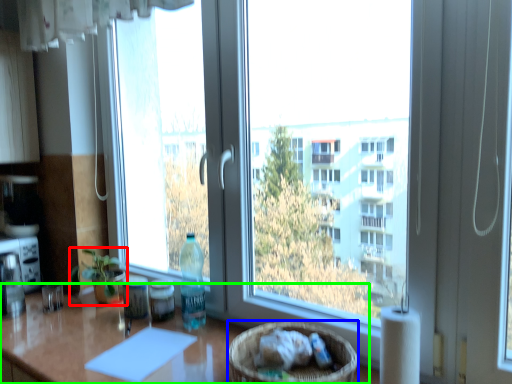
Question: Considering the real-world distances, which object is closest to houseplant (highlighted by a red box)? basket (highlighted by a blue box) or table (highlighted by a green box).

Choices:
 (A) basket
 (B) table

Answer: (B)